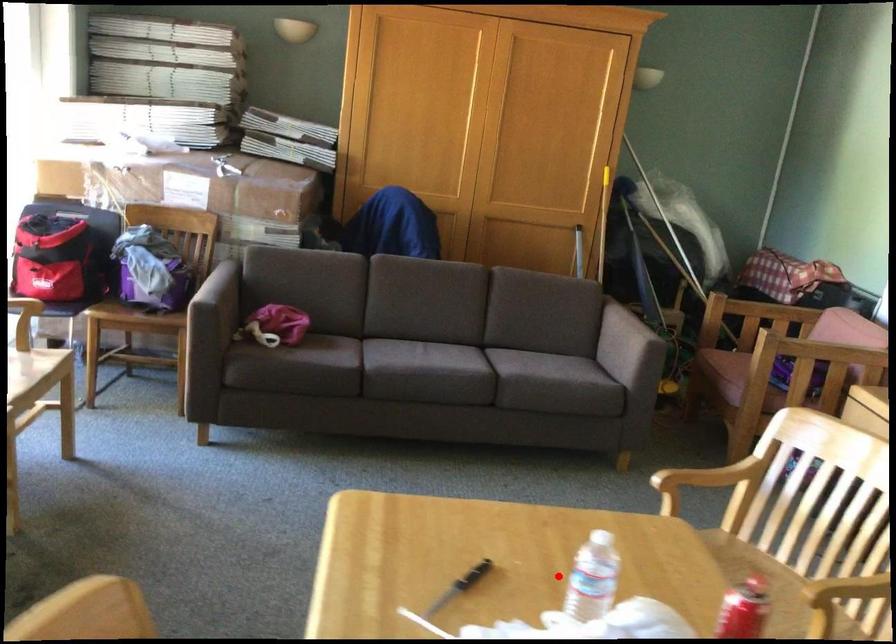
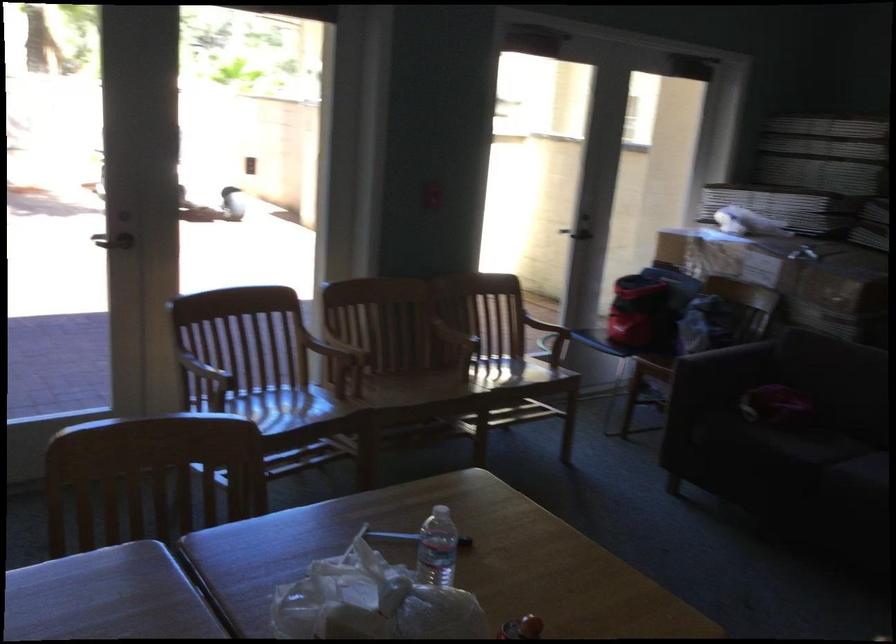
Question: I am providing you with two images of the same scene from different viewpoints. A red point is marked on the first image. Can you still see the location of the red point in image 2?

Choices:
 (A) Yes
 (B) No

Answer: (A)